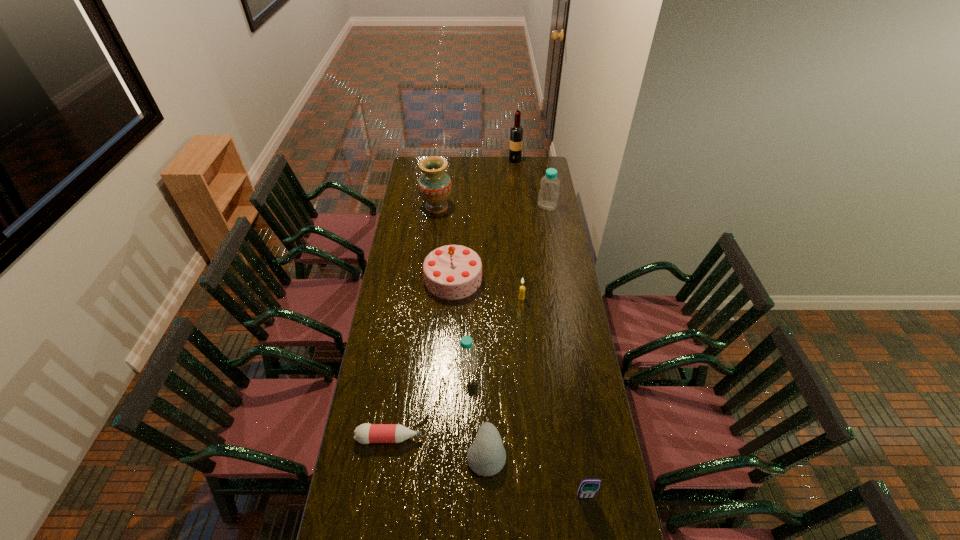
Where is `vacant space situated 0.200m on the back of the eighth tallest object`? This screenshot has width=960, height=540. vacant space situated 0.200m on the back of the eighth tallest object is located at coordinates (486, 382).

At what (x,y) coordinates should I click in order to perform the action: click on vacant region located 0.150m with the cap open on the leftmost bottle. Please return your answer as a coordinate pair (x, y). The width and height of the screenshot is (960, 540). Looking at the image, I should click on coord(464,438).

You are a GUI agent. You are given a task and a screenshot of the screen. Output one action in this format:
    pyautogui.click(x=<x>, y=<y>)
    Task: Click on the object that is at the far edge
    The height and width of the screenshot is (540, 960).
    Given the screenshot: What is the action you would take?
    click(516, 132)

I want to click on vase located at the left edge, so click(434, 186).

Image resolution: width=960 pixels, height=540 pixels. Find the location of `bottle located at the left edge`. bottle located at the left edge is located at coordinates point(366,433).

The image size is (960, 540). Identify the location of bottle that is at the right edge. (548, 195).

Where is `cellular telephone that is at the right edge`? Image resolution: width=960 pixels, height=540 pixels. cellular telephone that is at the right edge is located at coordinates (588, 488).

This screenshot has height=540, width=960. In the image, there is a desktop. What are the coordinates of `vacant space at the far edge` in the screenshot? It's located at (508, 161).

At what (x,y) coordinates should I click in order to perform the action: click on free location at the left edge of the desktop. Please return your answer as a coordinate pair (x, y). Looking at the image, I should click on (392, 373).

In order to click on blank space at the right edge in this screenshot , I will do click(x=620, y=524).